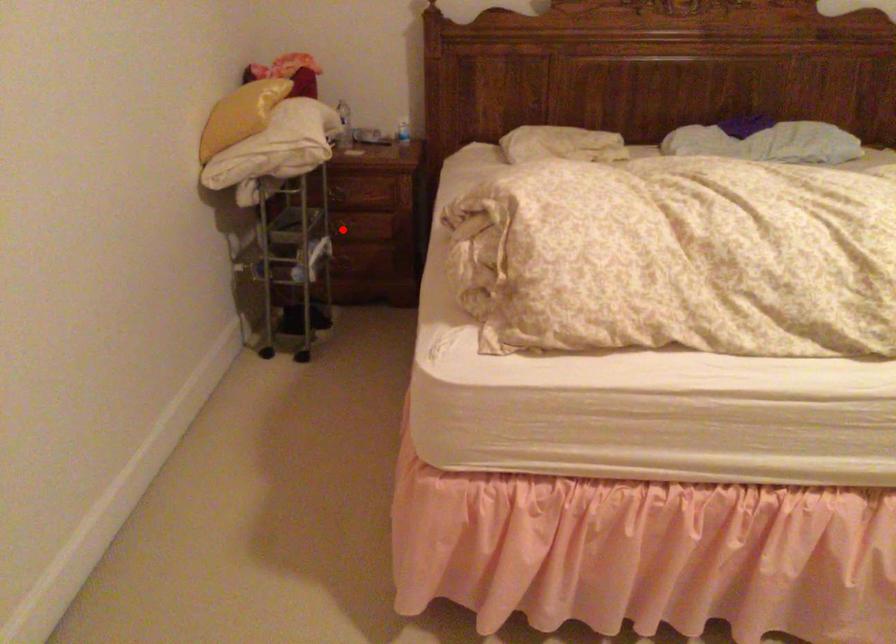
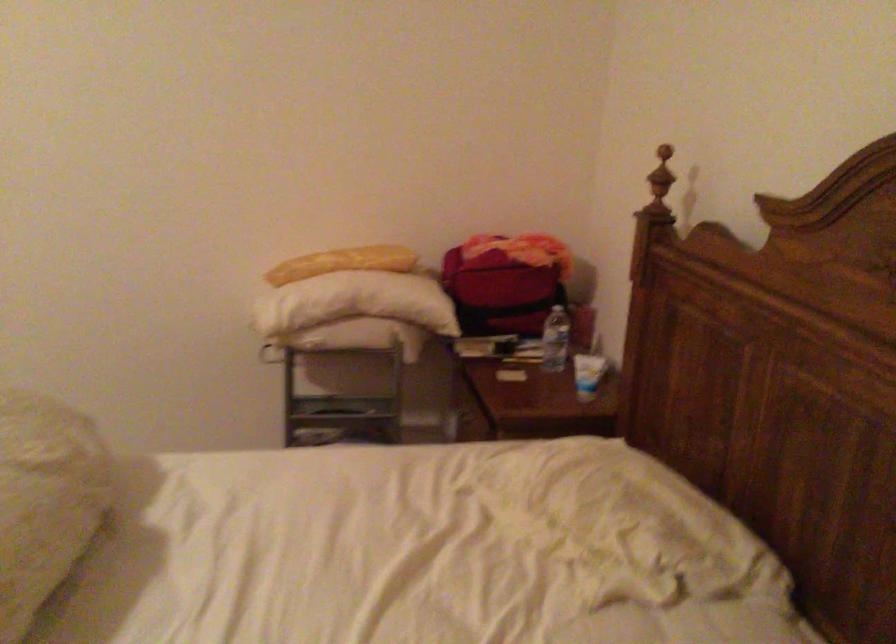
Question: I am providing you with two images of the same scene from different viewpoints. A red point is marked on the first image. At the location where the point appears in image 1, is it still visible in image 2?

Choices:
 (A) Yes
 (B) No

Answer: (B)